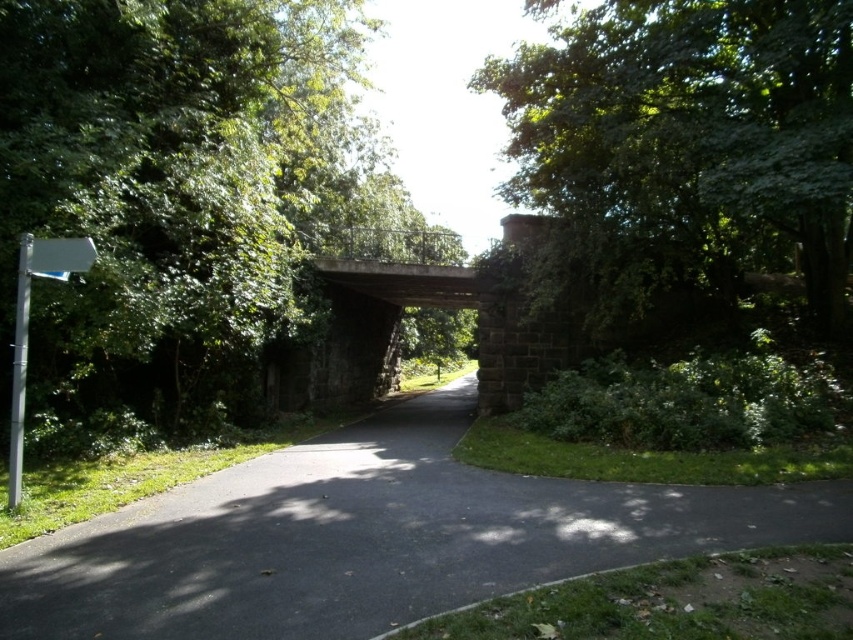
Question: Which object is positioned farthest from the green leafy tree at upper left?

Choices:
 (A) asphalt at center
 (B) white plastic sign at left
 (C) green leafy tree at upper right

Answer: (B)

Question: Is asphalt at center smaller than white plastic sign at left?

Choices:
 (A) yes
 (B) no

Answer: (B)

Question: Considering the relative positions of green leafy tree at upper left and green leafy tree at upper right in the image provided, where is green leafy tree at upper left located with respect to green leafy tree at upper right?

Choices:
 (A) below
 (B) above

Answer: (B)

Question: Among these objects, which one is nearest to the camera?

Choices:
 (A) white plastic sign at left
 (B) green leafy tree at upper right
 (C) asphalt at center
 (D) green leafy tree at upper left

Answer: (C)

Question: Can you confirm if green leafy tree at upper right is thinner than white plastic sign at left?

Choices:
 (A) yes
 (B) no

Answer: (B)

Question: Which object appears farthest from the camera in this image?

Choices:
 (A) asphalt at center
 (B) concrete bridge at center
 (C) green leafy tree at upper right
 (D) green leafy tree at upper left

Answer: (B)